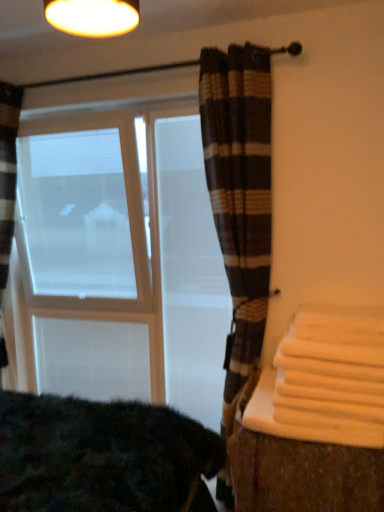
Measure the distance between point (327,444) and camera.

Point (327,444) and camera are 5.50 feet apart.

Measure the distance between dark textured blanket at lower left and camera.

1.28 meters.

Image resolution: width=384 pixels, height=512 pixels. What do you see at coordinates (103, 456) in the screenshot?
I see `dark textured blanket at lower left` at bounding box center [103, 456].

The height and width of the screenshot is (512, 384). I want to click on white matte window screen at left, so click(x=82, y=213).

What do you see at coordinates (239, 197) in the screenshot?
I see `plaid fabric curtain at center` at bounding box center [239, 197].

Image resolution: width=384 pixels, height=512 pixels. What are the coordinates of `white fabric at right` in the screenshot? It's located at (x=298, y=463).

Considering the positions of objects plaid fabric curtain at center and white frosted glass bay window at left in the image provided, who is more to the left, plaid fabric curtain at center or white frosted glass bay window at left?

white frosted glass bay window at left.

Which of these two, plaid fabric curtain at center or white frosted glass bay window at left, stands taller?

plaid fabric curtain at center is taller.

Is plaid fabric curtain at center closer to the viewer compared to white frosted glass bay window at left?

Yes, plaid fabric curtain at center is in front of white frosted glass bay window at left.

Is plaid fabric curtain at center positioned with its back to white frosted glass bay window at left?

No, white frosted glass bay window at left is not at the back of plaid fabric curtain at center.

Does dark textured blanket at lower left have a lesser height compared to white fabric at right?

No, dark textured blanket at lower left is not shorter than white fabric at right.

Is dark textured blanket at lower left turned away from white fabric at right?

No.

Measure the distance from dark textured blanket at lower left to white fabric at right.

46.46 centimeters.

Between dark textured blanket at lower left and white fabric at right, which one has smaller width?

With smaller width is white fabric at right.

Is plaid fabric curtain at center not within white matte window screen at left?

That's correct, plaid fabric curtain at center is outside of white matte window screen at left.

Is plaid fabric curtain at center oriented away from white matte window screen at left?

plaid fabric curtain at center is not turned away from white matte window screen at left.

Between plaid fabric curtain at center and white matte window screen at left, which one has smaller size?

Smaller between the two is white matte window screen at left.

Considering the sizes of objects plaid fabric curtain at center and white matte window screen at left in the image provided, who is wider, plaid fabric curtain at center or white matte window screen at left?

With larger width is plaid fabric curtain at center.

Is white fabric at right next to white matte window screen at left and touching it?

No, white fabric at right is not in contact with white matte window screen at left.

From the image's perspective, who appears lower, white fabric at right or white matte window screen at left?

white fabric at right appears lower in the image.

From a real-world perspective, who is located lower, white fabric at right or white matte window screen at left?

From a 3D spatial view, white fabric at right is below.

Can you confirm if white fabric at right is wider than white matte window screen at left?

Yes, white fabric at right is wider than white matte window screen at left.

From the picture: Can you tell me how much white matte screen door at center and dark textured blanket at lower left differ in facing direction?

white matte screen door at center and dark textured blanket at lower left are facing 88 degrees away from each other.

Which point is more forward, (175,204) or (109,434)?

The point (109,434) is more forward.

Who is taller, white matte screen door at center or dark textured blanket at lower left?

white matte screen door at center.

Could you tell me if white matte screen door at center is turned towards dark textured blanket at lower left?

Yes, white matte screen door at center is turned towards dark textured blanket at lower left.

Is white fabric at right in contact with white frosted glass bay window at left?

They are not placed beside each other.

Considering the sizes of objects white fabric at right and white frosted glass bay window at left in the image provided, who is taller, white fabric at right or white frosted glass bay window at left?

Standing taller between the two is white frosted glass bay window at left.

Do you think white fabric at right is within white frosted glass bay window at left, or outside of it?

white fabric at right is not inside white frosted glass bay window at left, it's outside.

Considering the sizes of white fabric at right and white frosted glass bay window at left in the image, is white fabric at right wider or thinner than white frosted glass bay window at left?

In the image, white fabric at right appears to be wider than white frosted glass bay window at left.

Is the position of orange cotton bath towel at right more distant than that of plaid fabric curtain at center?

No, the depth of orange cotton bath towel at right is less than that of plaid fabric curtain at center.

Does point (304, 420) come closer to viewer compared to point (246, 323)?

Yes, point (304, 420) is closer to viewer.

Would you say orange cotton bath towel at right is a long distance from plaid fabric curtain at center?

orange cotton bath towel at right is near plaid fabric curtain at center, not far away.

Considering the sizes of orange cotton bath towel at right and plaid fabric curtain at center in the image, is orange cotton bath towel at right taller or shorter than plaid fabric curtain at center?

Considering their sizes, orange cotton bath towel at right has less height than plaid fabric curtain at center.

You are a GUI agent. You are given a task and a screenshot of the screen. Output one action in this format:
    pyautogui.click(x=<x>, y=<y>)
    Task: Click on the bay window below the plaid fabric curtain at center (from the image's perspective)
    This screenshot has width=384, height=512.
    Given the screenshot: What is the action you would take?
    pyautogui.click(x=122, y=260)

At what (x,y) coordinates should I click in order to perform the action: click on bedding in front of the white fabric at right. Please return your answer as a coordinate pair (x, y). Looking at the image, I should click on click(x=103, y=456).

Which object lies further to the anchor point white matte screen door at center, orange cotton bath towel at right or plaid fabric curtain at center?

orange cotton bath towel at right is further to white matte screen door at center.

Based on their spatial positions, is orange cotton bath towel at right or white fabric at right further from plaid fabric curtain at center?

orange cotton bath towel at right.

When comparing their distances from dark textured blanket at lower left, does white matte window screen at left or white frosted glass bay window at left seem closer?

The object closer to dark textured blanket at lower left is white frosted glass bay window at left.

Considering their positions, is plaid fabric curtain at center positioned closer to white frosted glass bay window at left than orange cotton bath towel at right?

Based on the image, plaid fabric curtain at center appears to be nearer to white frosted glass bay window at left.

Which object lies nearer to the anchor point dark textured blanket at lower left, white matte screen door at center or orange cotton bath towel at right?

orange cotton bath towel at right is closer to dark textured blanket at lower left.

In the scene shown: Which object lies further to the anchor point white frosted glass bay window at left, white matte screen door at center or white matte window screen at left?

Based on the image, white matte screen door at center appears to be further to white frosted glass bay window at left.

Which object lies further to the anchor point dark textured blanket at lower left, white matte screen door at center or plaid fabric curtain at center?

Among the two, white matte screen door at center is located further to dark textured blanket at lower left.

Estimate the real-world distances between objects in this image. Which object is further from white frosted glass bay window at left, orange cotton bath towel at right or dark textured blanket at lower left?

orange cotton bath towel at right is positioned further to the anchor white frosted glass bay window at left.

Image resolution: width=384 pixels, height=512 pixels. I want to click on bay window situated between white matte window screen at left and orange cotton bath towel at right from left to right, so tap(122, 260).

The width and height of the screenshot is (384, 512). Identify the location of curtain between white matte window screen at left and orange cotton bath towel at right from left to right. (239, 197).

Where is `bath towel between dark textured blanket at lower left and white frosted glass bay window at left from front to back`? The image size is (384, 512). bath towel between dark textured blanket at lower left and white frosted glass bay window at left from front to back is located at coordinates (333, 374).

The image size is (384, 512). In order to click on table between dark textured blanket at lower left and white matte screen door at center along the z-axis in this screenshot , I will do `click(298, 463)`.